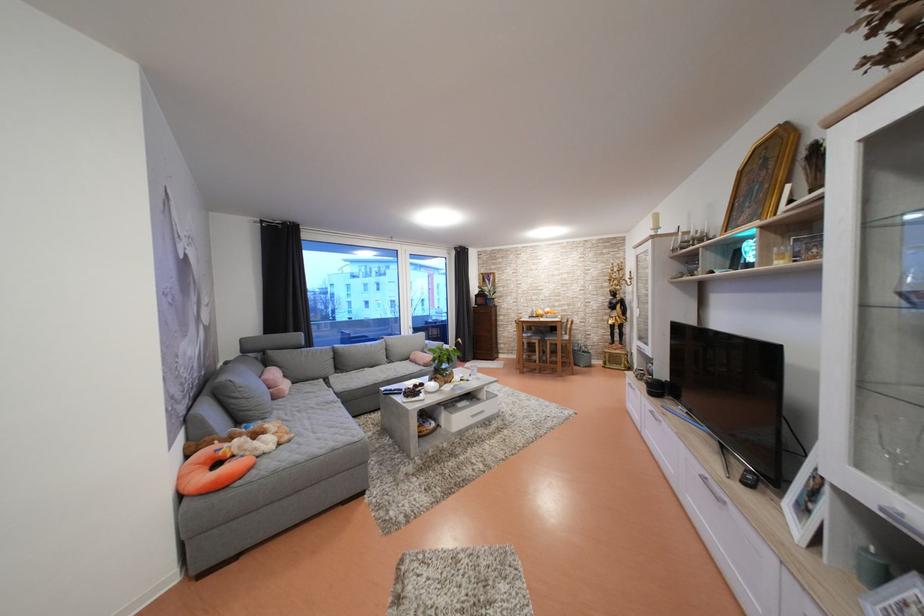
What are the coordinates of `small silver handle` in the screenshot? It's located at (712, 488).